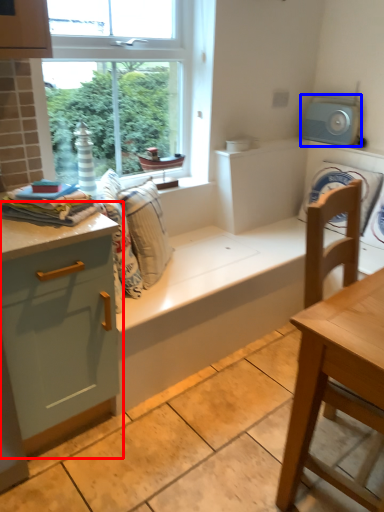
Question: Which object appears closest to the camera in this image, dresser (highlighted by a red box) or appliance (highlighted by a blue box)?

Choices:
 (A) dresser
 (B) appliance

Answer: (A)